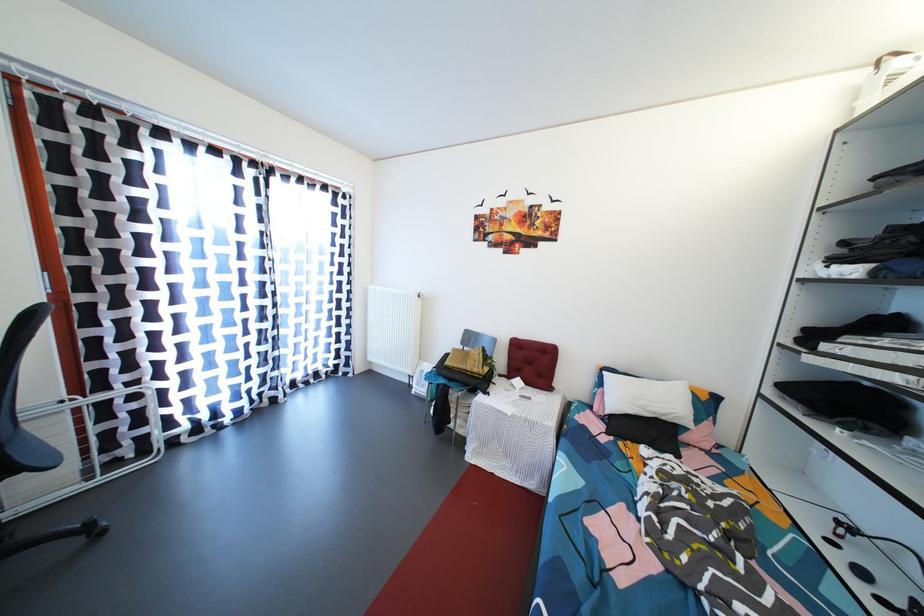
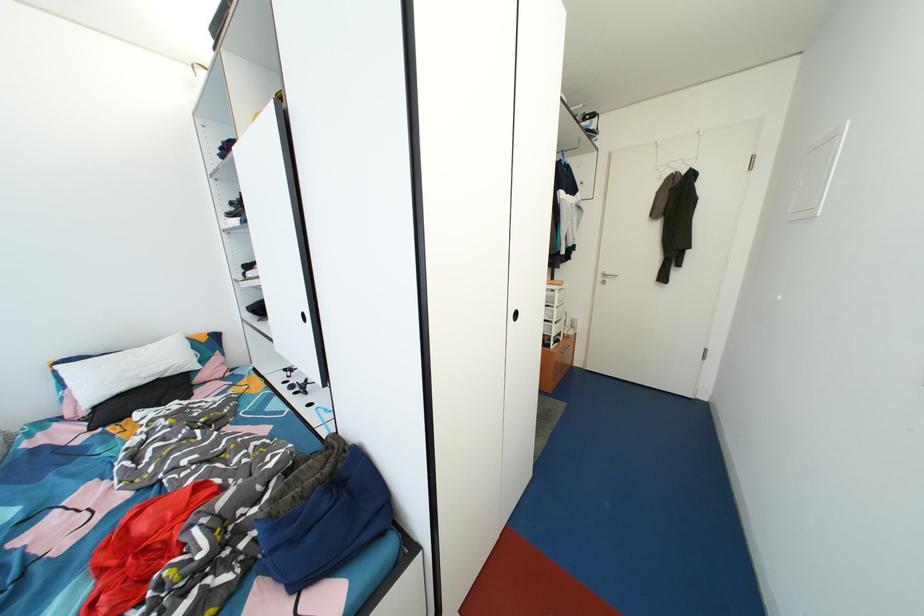
Where in the second image is the point corresponding to [671,416] from the first image?

(167, 373)